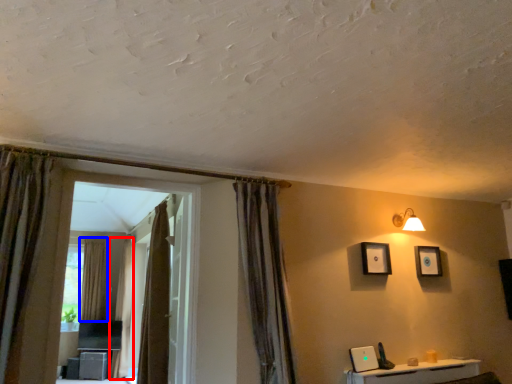
Question: Which object is further to the camera taking this photo, curtain (highlighted by a red box) or curtain (highlighted by a blue box)?

Choices:
 (A) curtain
 (B) curtain

Answer: (B)